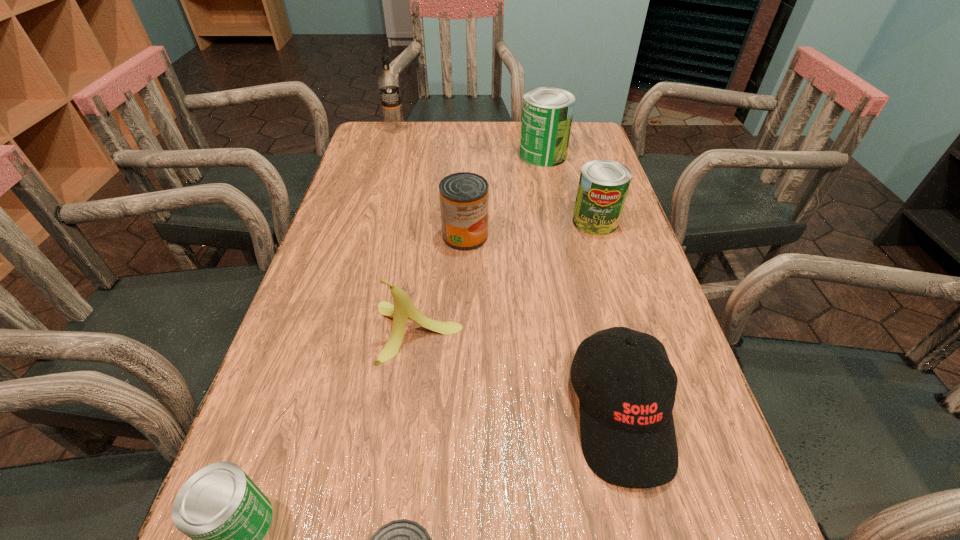
Where is `free space located on the front of the farther red can`? The width and height of the screenshot is (960, 540). free space located on the front of the farther red can is located at coordinates click(462, 316).

Where is `vacant space located 0.350m on the back of the second nearest green can`? The image size is (960, 540). vacant space located 0.350m on the back of the second nearest green can is located at coordinates (572, 142).

Find the location of a particular element. Image resolution: width=960 pixels, height=540 pixels. free spot located on the back of the banana is located at coordinates (429, 243).

Locate an element on the screen. vodka that is at the far edge is located at coordinates (388, 83).

Identify the location of can present at the far edge. (547, 113).

Where is `object situated at the left edge`? The height and width of the screenshot is (540, 960). object situated at the left edge is located at coordinates (388, 83).

Identify the location of baseball cap that is at the right edge. This screenshot has height=540, width=960. (627, 431).

The image size is (960, 540). Identify the location of object positioned at the far left corner. (388, 83).

Identify the location of object at the far right corner. (547, 113).

Image resolution: width=960 pixels, height=540 pixels. What are the coordinates of `vacant space at the far edge` in the screenshot? It's located at (521, 122).